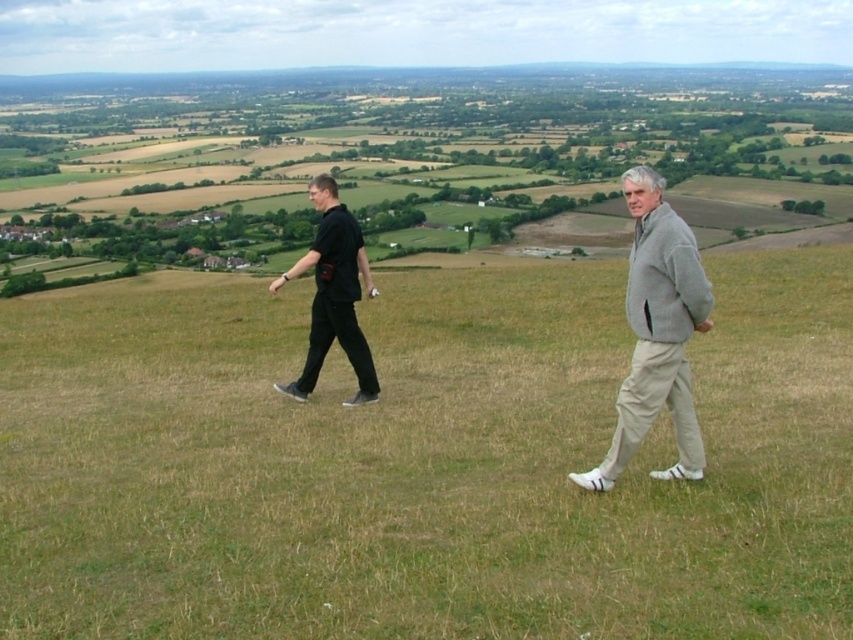
You are standing on the grassy hillside and want to take a photo of the gray fleece jacket at center and the black matte pants at left. Which object should you focus on first to ensure both are in the frame?

You should focus on the gray fleece jacket at center first because it is closer to the viewer than the black matte pants at left, ensuring both are in the frame.

You are a photographer positioned at the bottom of the hill. You want to capture both the black cotton shirt at left and the gray fleece jacket at center in a single shot. Which subject should you focus on first to ensure both are in sharp focus?

You should focus on the gray fleece jacket at center first because it is behind the black cotton shirt at left, so focusing on the farther subject will keep both in focus.

You are standing on the grassy hillside and want to walk towards the green grassy field at center and the black cotton shirt at left. Which object will you reach first?

You will reach the green grassy field at center first because it is closer to you than the black cotton shirt at left.